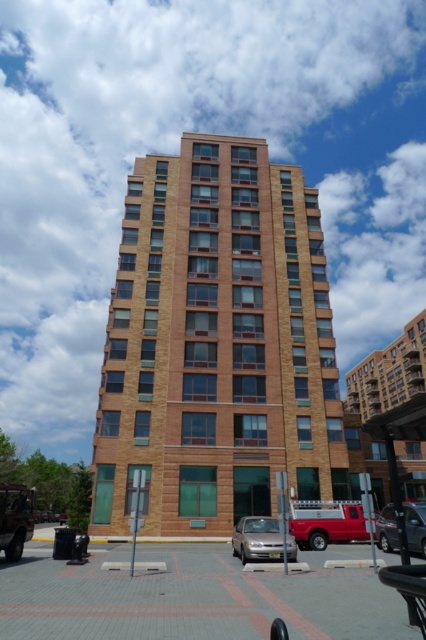
Is matte red truck at lower center wider than silver metallic sedan at center?

No, matte red truck at lower center is not wider than silver metallic sedan at center.

This screenshot has height=640, width=426. I want to click on matte red truck at lower center, so click(325, 522).

In the scene shown: Who is positioned more to the left, silver metallic sedan at center or matte black suv at lower left?

From the viewer's perspective, matte black suv at lower left appears more on the left side.

Does point (258, 528) come farther from viewer compared to point (25, 522)?

Yes, it is.

Locate an element on the screen. The image size is (426, 640). silver metallic sedan at center is located at coordinates (256, 540).

Does brown brick building at center appear under metallic silver car at center?

Actually, brown brick building at center is above metallic silver car at center.

Measure the distance between brown brick building at center and metallic silver car at center.

brown brick building at center and metallic silver car at center are 17.42 meters apart.

At what (x,y) coordinates should I click in order to perform the action: click on brown brick building at center. Please return your answer as a coordinate pair (x, y). Looking at the image, I should click on (216, 344).